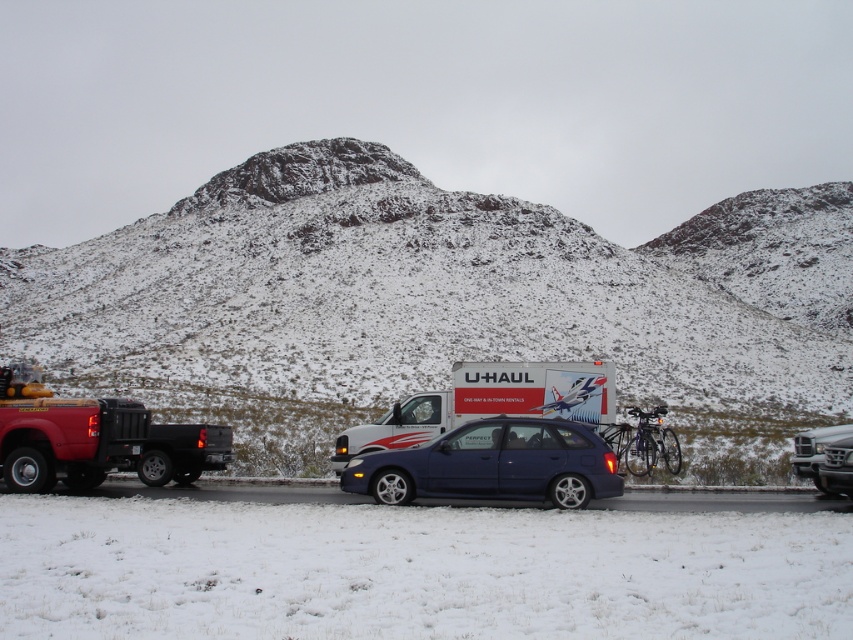
Question: Is metallic blue hatchback at center thinner than metallic silver suv at center?

Choices:
 (A) yes
 (B) no

Answer: (A)

Question: Which point appears farthest from the camera in this image?

Choices:
 (A) (79, 468)
 (B) (474, 413)
 (C) (822, 488)

Answer: (B)

Question: Which object appears closest to the camera in this image?

Choices:
 (A) matte red tow truck at left
 (B) metallic silver suv at center

Answer: (A)

Question: Which object appears closest to the camera in this image?

Choices:
 (A) snow-covered rock at upper center
 (B) metallic silver suv at center
 (C) matte red tow truck at left
 (D) metallic blue hatchback at center

Answer: (D)

Question: Does white glossy u-haul truck at center appear over metallic silver suv at center?

Choices:
 (A) no
 (B) yes

Answer: (B)

Question: Does matte red tow truck at left have a greater width compared to metallic blue hatchback at center?

Choices:
 (A) yes
 (B) no

Answer: (B)